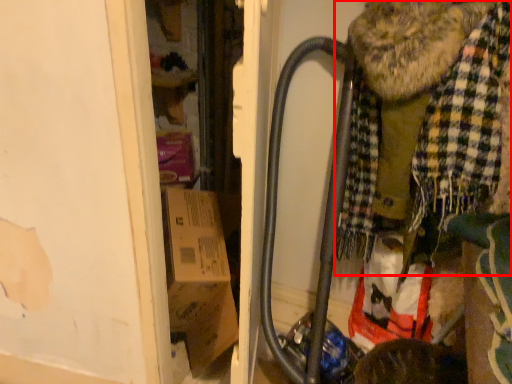
Question: Considering the relative positions of scarf (annotated by the red box) and baby carriage in the image provided, where is scarf (annotated by the red box) located with respect to the staircase?

Choices:
 (A) left
 (B) right

Answer: (A)